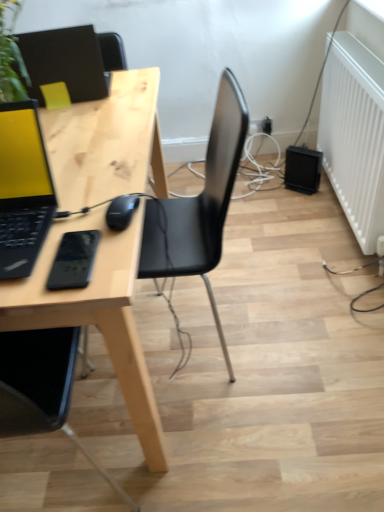
Find the location of a particular element. This screenshot has height=512, width=384. vacant space behind black matte mouse at center is located at coordinates (109, 176).